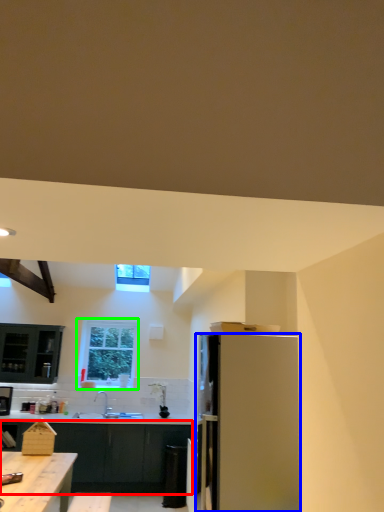
Question: Considering the real-world distances, which object is farthest from cabinetry (highlighted by a red box)? refrigerator (highlighted by a blue box) or window (highlighted by a green box)?

Choices:
 (A) refrigerator
 (B) window

Answer: (A)